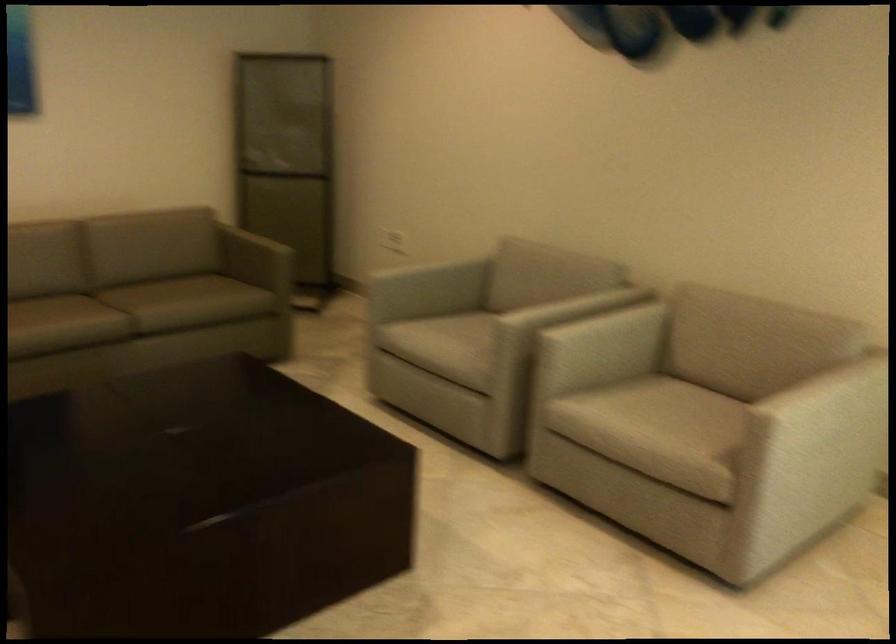
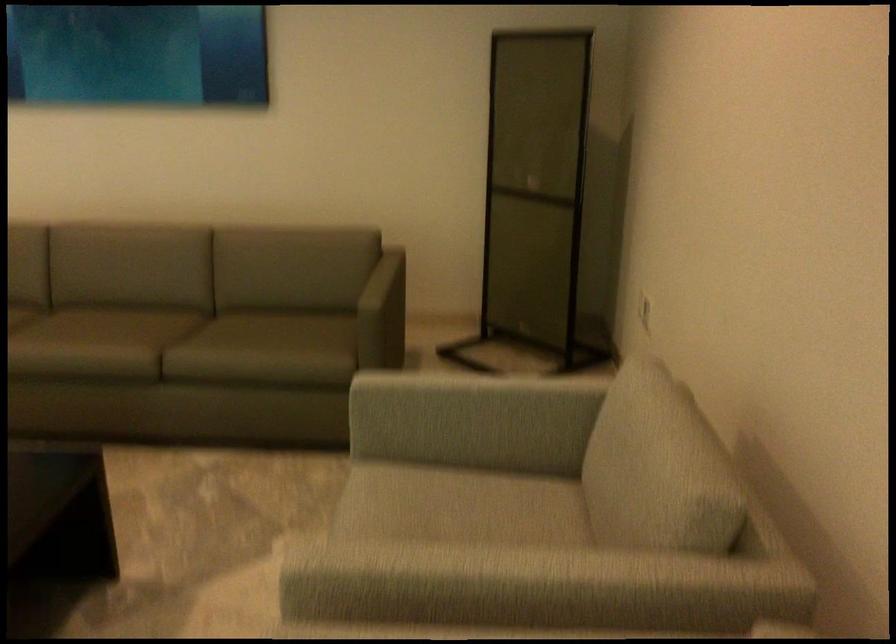
Where in the second image is the point corresponding to point (555, 257) from the first image?

(653, 451)